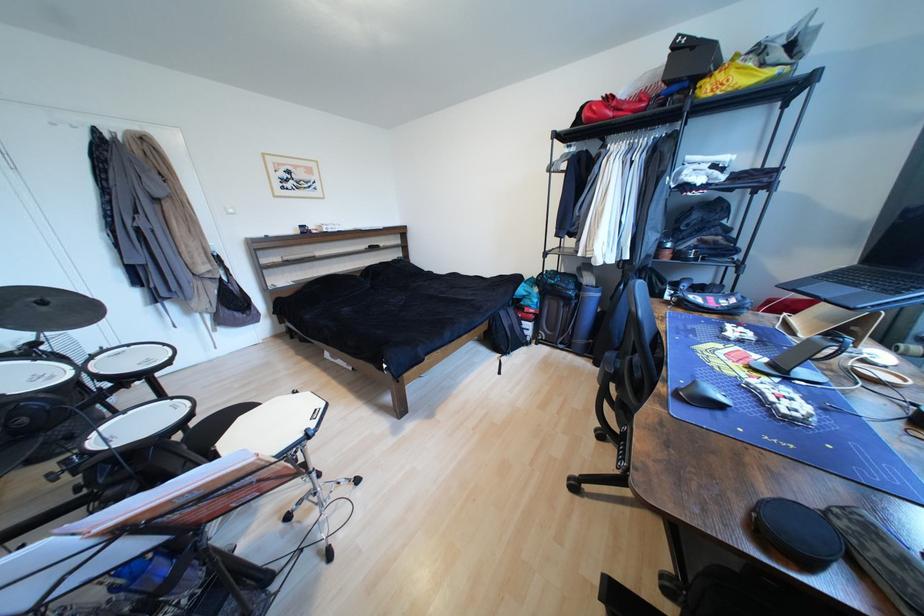
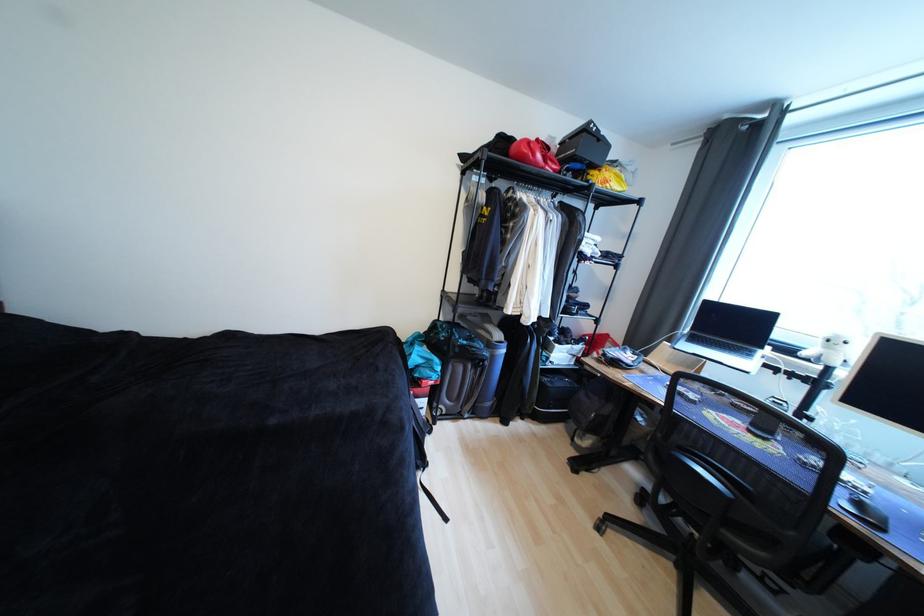
Find the pixel in the second image that matches pixel 557 286 in the first image.

(469, 347)